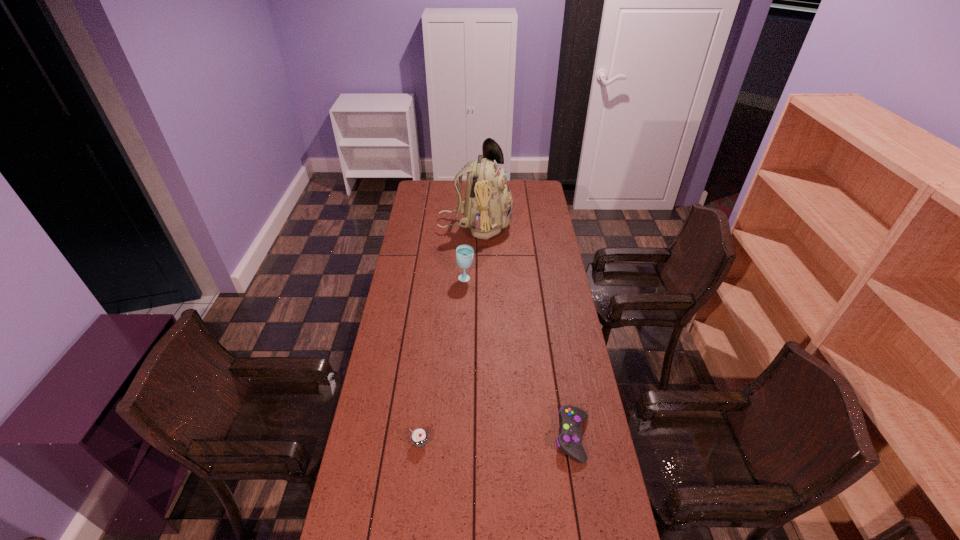
Identify the location of the tallest object. (487, 208).

In order to click on the farthest object in this screenshot , I will do `click(487, 208)`.

Identify the location of the third nearest object. The height and width of the screenshot is (540, 960). (464, 253).

Identify the location of the third shortest object. This screenshot has width=960, height=540. (464, 253).

Where is `cupcake`? Image resolution: width=960 pixels, height=540 pixels. cupcake is located at coordinates (419, 437).

I want to click on the shortest object, so coord(569,441).

You are a GUI agent. You are given a task and a screenshot of the screen. Output one action in this format:
    pyautogui.click(x=<x>, y=<y>)
    Task: Click on the control
    
    Given the screenshot: What is the action you would take?
    pyautogui.click(x=569, y=441)

I want to click on vacant space located on the front-facing side of the farthest object, so click(x=532, y=225).

I want to click on free space located on the back of the second farthest object, so click(468, 236).

Where is `blank area located 0.340m on the right of the second shortest object`? This screenshot has width=960, height=540. blank area located 0.340m on the right of the second shortest object is located at coordinates (534, 443).